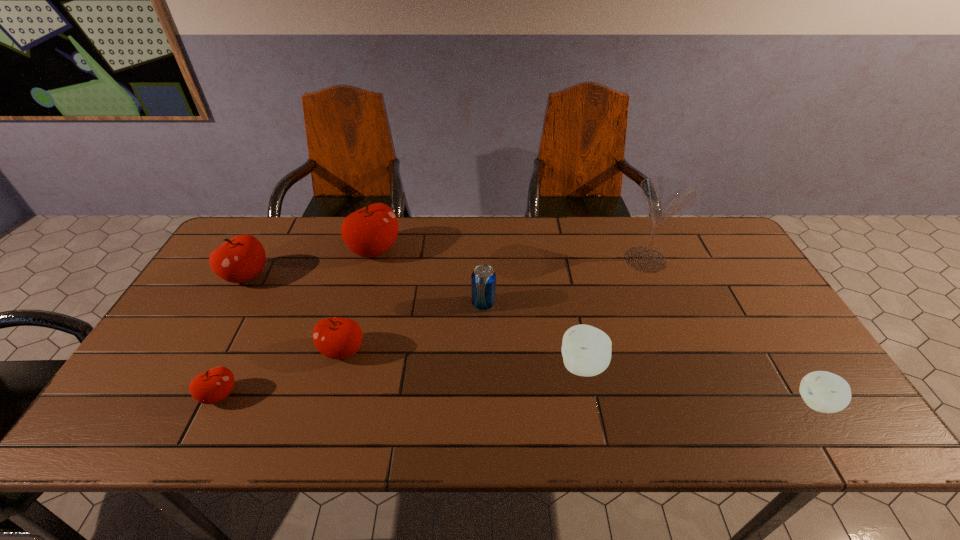
Locate an element on the screen. This screenshot has height=540, width=960. the tallest object is located at coordinates (664, 196).

At what (x,y) coordinates should I click in order to perform the action: click on the second object from right to left. Please return your answer as a coordinate pair (x, y). Image resolution: width=960 pixels, height=540 pixels. Looking at the image, I should click on (664, 196).

At what (x,y) coordinates should I click in order to perform the action: click on the second tallest object. Please return your answer as a coordinate pair (x, y). This screenshot has height=540, width=960. Looking at the image, I should click on (371, 231).

Identify the location of the tallest apple. The height and width of the screenshot is (540, 960). point(371,231).

Image resolution: width=960 pixels, height=540 pixels. Identify the location of the third tallest object. (242, 258).

The height and width of the screenshot is (540, 960). Identify the location of the second biggest red apple. (242, 258).

This screenshot has width=960, height=540. Find the location of `the fourth object from right to left`. the fourth object from right to left is located at coordinates point(483,279).

You are a GUI agent. You are given a task and a screenshot of the screen. Output one action in this format:
    pyautogui.click(x=<x>, y=<y>)
    Task: Click on the beer can
    Image resolution: width=960 pixels, height=540 pixels.
    Given the screenshot: What is the action you would take?
    pyautogui.click(x=483, y=279)

Find the location of a particular element. Image resolution: width=960 pixels, height=540 pixels. the left white apple is located at coordinates (586, 350).

Image resolution: width=960 pixels, height=540 pixels. In order to click on the farther white apple in this screenshot , I will do `click(586, 350)`.